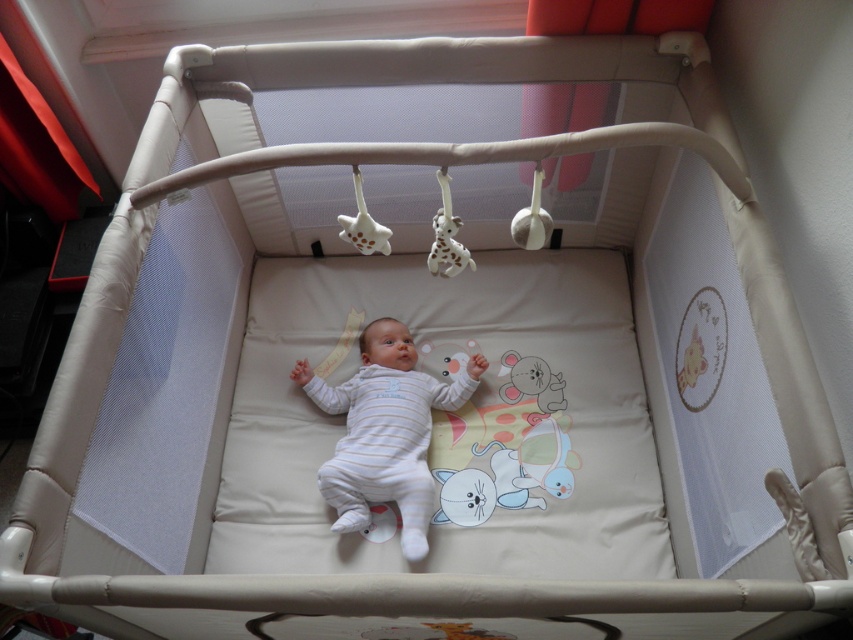
Between white soft baby at center and white matte giraffe at upper center, which one appears on the left side from the viewer's perspective?

Positioned to the left is white matte giraffe at upper center.

Is white soft baby at center smaller than white matte giraffe at upper center?

Incorrect, white soft baby at center is not smaller in size than white matte giraffe at upper center.

I want to click on white soft baby at center, so click(386, 432).

The image size is (853, 640). What are the coordinates of `white soft baby at center` in the screenshot? It's located at (386, 432).

Is point (381, 452) positioned before point (526, 216)?

No.

This screenshot has height=640, width=853. Describe the element at coordinates (386, 432) in the screenshot. I see `white soft baby at center` at that location.

Find the location of a particular element. This screenshot has height=640, width=853. white soft baby at center is located at coordinates (386, 432).

Is white spotted plastic giraffe at upper center thinner than white matte plush toy at upper center?

No.

Is white spotted plastic giraffe at upper center to the left of white matte plush toy at upper center from the viewer's perspective?

Yes, white spotted plastic giraffe at upper center is to the left of white matte plush toy at upper center.

Describe the element at coordinates (445, 236) in the screenshot. I see `white spotted plastic giraffe at upper center` at that location.

Locate an element on the screen. white spotted plastic giraffe at upper center is located at coordinates (445, 236).